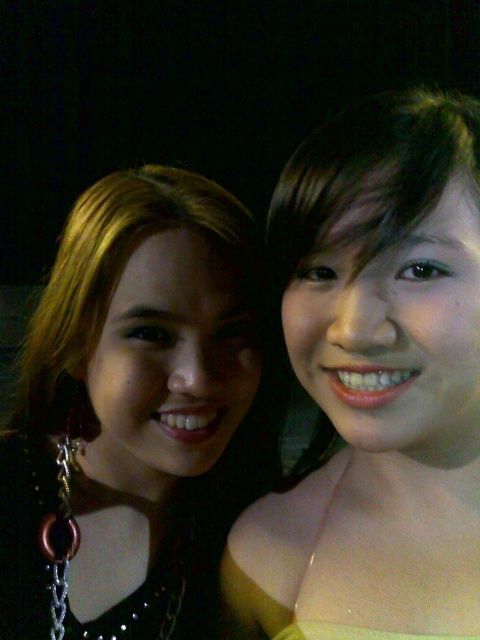
Is matte yellow dress at center smaller than matte black hair at left?

Yes, matte yellow dress at center is smaller than matte black hair at left.

Is point (410, 484) in front of point (118, 570)?

Yes, it is in front of point (118, 570).

At what (x,y) coordinates should I click in order to perform the action: click on matte yellow dress at center. Please return your answer as a coordinate pair (x, y). Looking at the image, I should click on (375, 381).

Identify the location of matte yellow dress at center. This screenshot has width=480, height=640. (375, 381).